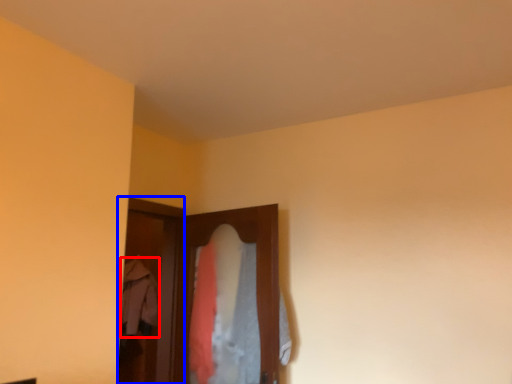
Question: Which object is closer to the camera taking this photo, clothing (highlighted by a red box) or screen door (highlighted by a blue box)?

Choices:
 (A) clothing
 (B) screen door

Answer: (B)